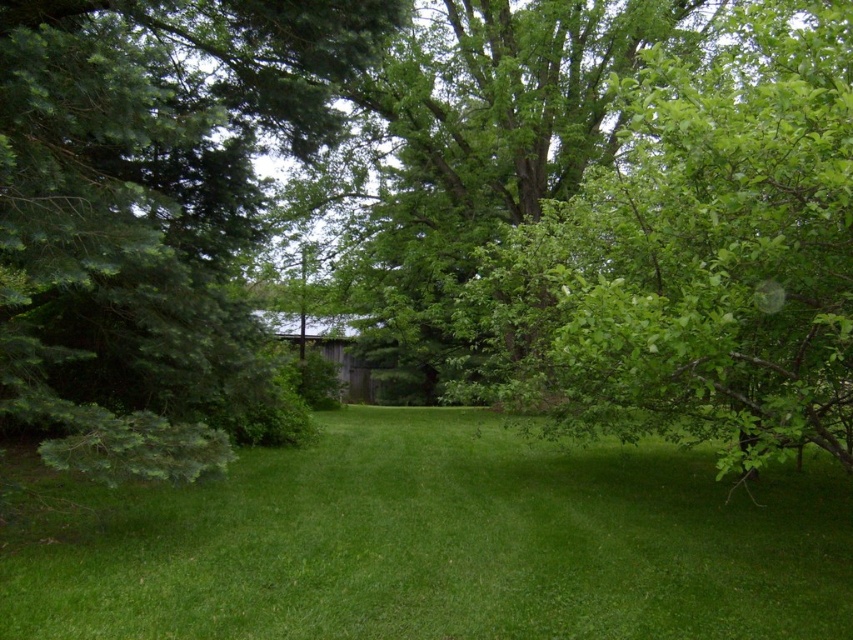
You are standing on the green grass at center and want to walk towards the green leafy tree at left. Is the tree farther away from you or closer?

The green leafy tree at left is farther away from you because the green grass at center is closer to the viewer than the tree.

You are planning to plant a new tree in your backyard. You have two options based on the image provided. The green leafy tree at left and the green leafy tree at right. Which tree would require less space in your yard?

The green leafy tree at left requires less space in your yard because it has a smaller size compared to the green leafy tree at right.

You are standing at the origin point in the image. Which direction should you move to reach the green grass at center?

The green grass at center is located at coordinates point (444, 545), so you should move towards the right and slightly upwards from your current position at the origin point.